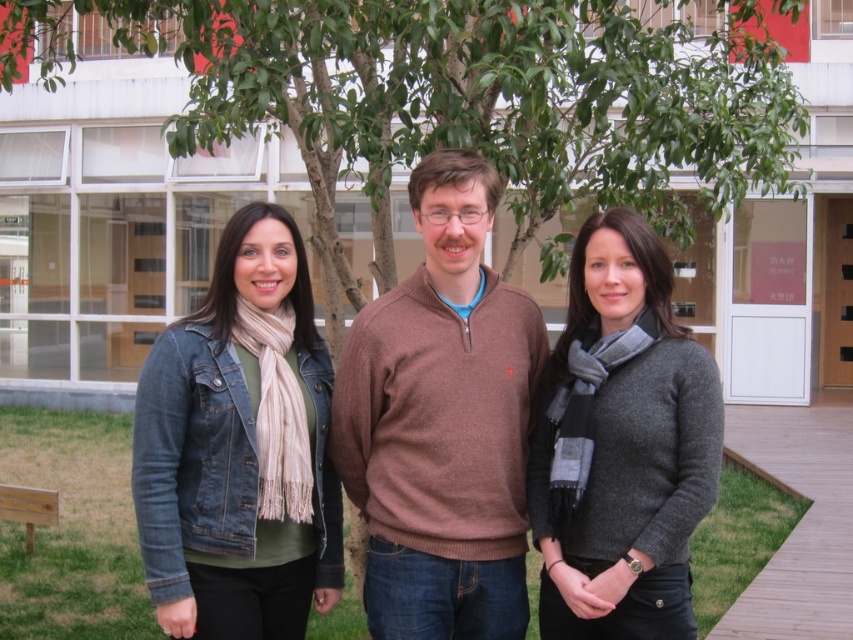
Who is lower down, denim jacket at center or gray wool sweater at center?

gray wool sweater at center is below.

Does denim jacket at center have a lesser height compared to gray wool sweater at center?

Incorrect, denim jacket at center's height does not fall short of gray wool sweater at center's.

You are a GUI agent. You are given a task and a screenshot of the screen. Output one action in this format:
    pyautogui.click(x=<x>, y=<y>)
    Task: Click on the denim jacket at center
    This screenshot has height=640, width=853.
    Given the screenshot: What is the action you would take?
    pyautogui.click(x=444, y=424)

Does brown wool sweater at center have a greater height compared to gray wool sweater at center?

Correct, brown wool sweater at center is much taller as gray wool sweater at center.

Between brown wool sweater at center and gray wool sweater at center, which one appears on the right side from the viewer's perspective?

Positioned to the right is gray wool sweater at center.

What do you see at coordinates (440, 422) in the screenshot? I see `brown wool sweater at center` at bounding box center [440, 422].

At what (x,y) coordinates should I click in order to perform the action: click on brown wool sweater at center. Please return your answer as a coordinate pair (x, y). Image resolution: width=853 pixels, height=640 pixels. Looking at the image, I should click on (440, 422).

Can you confirm if brown wool sweater at center is bigger than denim jacket at left?

Correct, brown wool sweater at center is larger in size than denim jacket at left.

Which is below, brown wool sweater at center or denim jacket at left?

denim jacket at left is below.

Where is `brown wool sweater at center`? This screenshot has height=640, width=853. brown wool sweater at center is located at coordinates (440, 422).